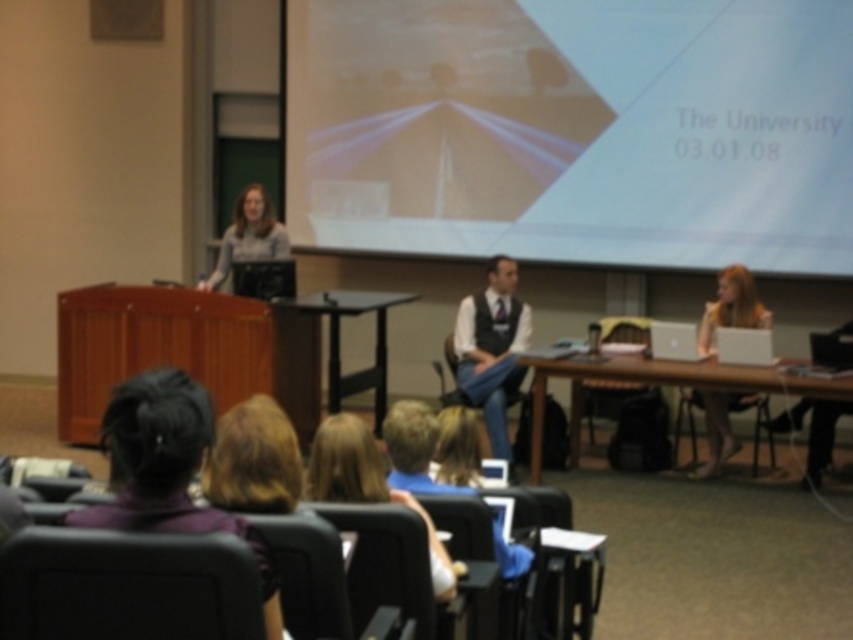
Question: Which point appears closest to the camera in this image?

Choices:
 (A) (338, 456)
 (B) (457, 160)
 (C) (242, 234)
 (D) (612, 336)

Answer: (A)

Question: Estimate the real-world distances between objects in this image. Which object is closer to the white matte projection screen at upper center?

Choices:
 (A) white plastic laptop at center
 (B) black leather chair at lower left

Answer: (A)

Question: Can you confirm if matte white laptop at right is positioned above silver metallic laptop at center?

Choices:
 (A) yes
 (B) no

Answer: (A)

Question: Is white matte projection screen at upper center to the left of dark brown hair at lower left from the viewer's perspective?

Choices:
 (A) yes
 (B) no

Answer: (B)

Question: Is dark brown hair at lower left smaller than white shirt with vest at center?

Choices:
 (A) yes
 (B) no

Answer: (A)

Question: Which point is farther to the camera?

Choices:
 (A) (498, 355)
 (B) (175, 401)

Answer: (A)